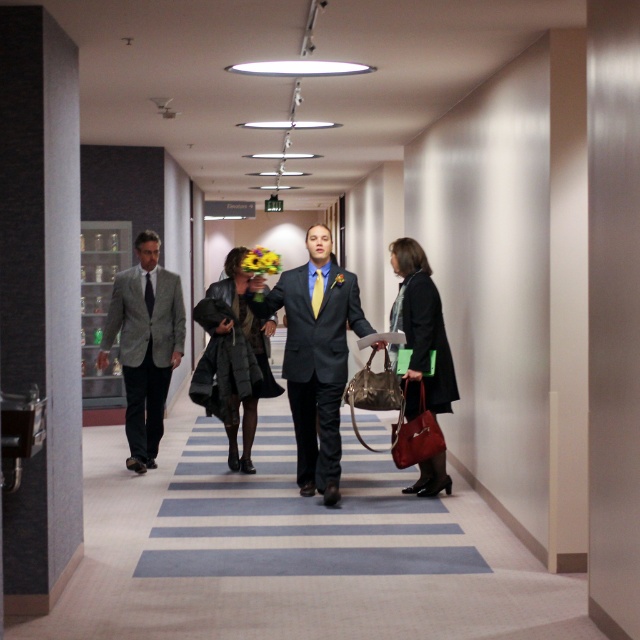
Is matte black suit at center positioned behind leather coat at center?

No, matte black suit at center is in front of leather coat at center.

Can you confirm if matte black suit at center is positioned below leather coat at center?

No.

Is point (365, 330) positioned before point (216, 390)?

Yes.

Identify the location of matte black suit at center. This screenshot has width=640, height=640. (316, 355).

Can you confirm if matte black suit at center is taller than leather jacket at right?

Correct, matte black suit at center is much taller as leather jacket at right.

Is matte black suit at center bigger than leather jacket at right?

Yes.

Between point (337, 323) and point (406, 419), which one is positioned in front?

Positioned in front is point (337, 323).

In order to click on matte black suit at center in this screenshot , I will do click(x=316, y=355).

What do you see at coordinates (145, 346) in the screenshot? The height and width of the screenshot is (640, 640). I see `gray wool suit at center` at bounding box center [145, 346].

Measure the distance between gray wool suit at center and leather coat at center.

gray wool suit at center is 35.59 inches from leather coat at center.

Which is behind, point (124, 365) or point (230, 285)?

The point (124, 365) is more distant.

You are a GUI agent. You are given a task and a screenshot of the screen. Output one action in this format:
    pyautogui.click(x=<x>, y=<y>)
    Task: Click on the gray wool suit at center
    The width and height of the screenshot is (640, 640).
    Given the screenshot: What is the action you would take?
    pyautogui.click(x=145, y=346)